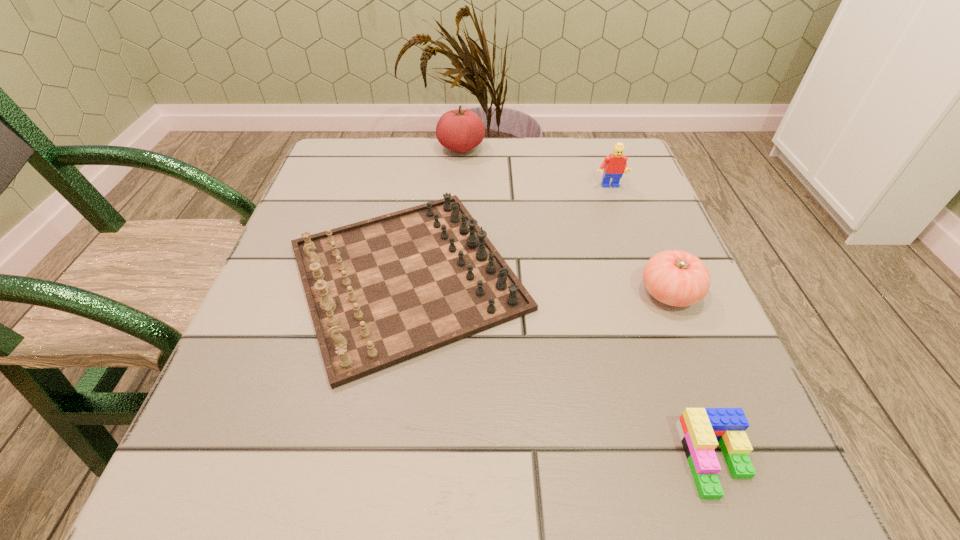
Where is `free region located 0.330m on the front-facing side of the taller Lego`? free region located 0.330m on the front-facing side of the taller Lego is located at coordinates pyautogui.click(x=650, y=305).

I want to click on vacant space located on the back of the chessboard, so click(428, 139).

Find the location of `free space located 0.140m on the left of the shorter tomato`. free space located 0.140m on the left of the shorter tomato is located at coordinates (558, 293).

The image size is (960, 540). What are the coordinates of `vacant space located 0.360m on the back of the nearest object` in the screenshot? It's located at (636, 246).

Identify the location of tomato situated at the far edge. (460, 130).

You are a GUI agent. You are given a task and a screenshot of the screen. Output one action in this format:
    pyautogui.click(x=<x>, y=<y>)
    Task: Click on the Lego that is at the far edge
    
    Given the screenshot: What is the action you would take?
    pyautogui.click(x=614, y=165)

At what (x,y) coordinates should I click in order to perform the action: click on object present at the near edge. Please return your answer as a coordinate pair (x, y). Looking at the image, I should click on (699, 429).

Identify the location of object located at the left edge. (381, 291).

The height and width of the screenshot is (540, 960). Identify the location of tomato present at the right edge. [677, 278].

This screenshot has height=540, width=960. Find the location of `object that is at the far right corner`. object that is at the far right corner is located at coordinates (614, 165).